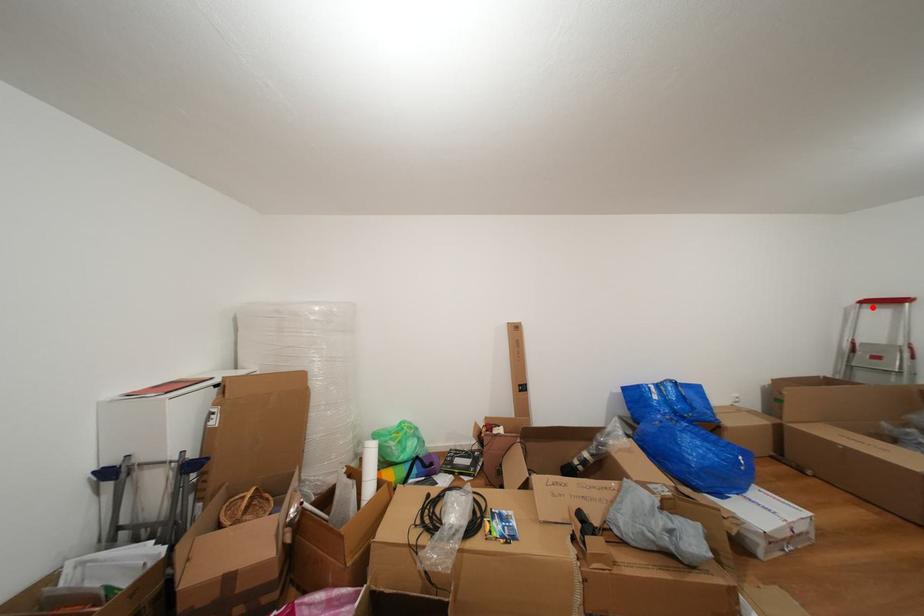
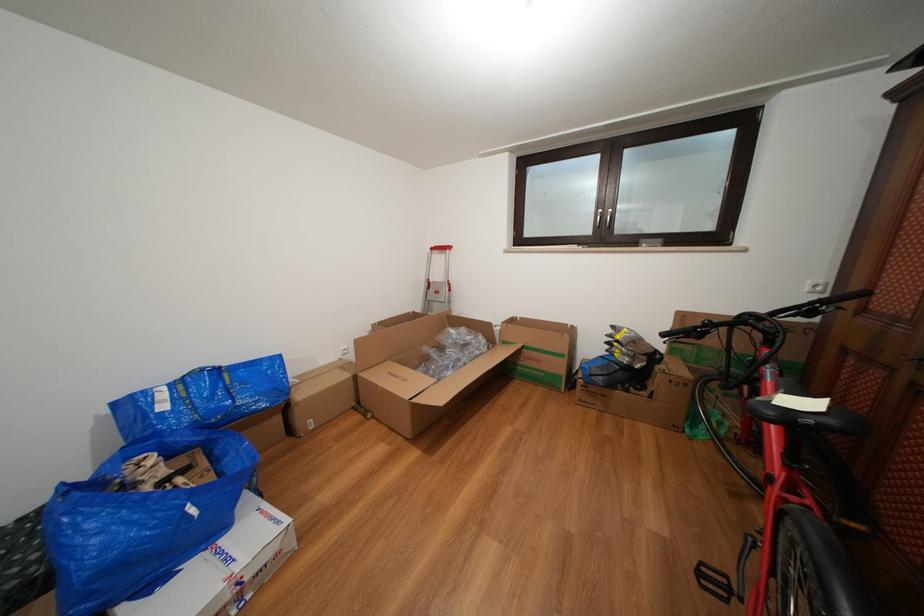
Find the pixel in the second image that matches the highlighted location in the first image.

(441, 254)